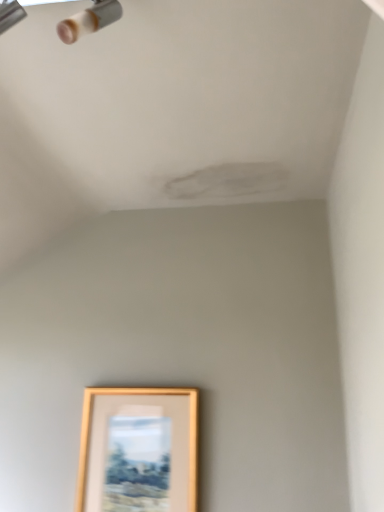
What do you see at coordinates (138, 450) in the screenshot? The image size is (384, 512). I see `gold wooden picture frame at lower center` at bounding box center [138, 450].

Where is `gold wooden picture frame at lower center`? The height and width of the screenshot is (512, 384). gold wooden picture frame at lower center is located at coordinates (138, 450).

You are a GUI agent. You are given a task and a screenshot of the screen. Output one action in this format:
    pyautogui.click(x=<x>, y=<y>)
    Task: Click on the gold wooden picture frame at lower center
    Image resolution: width=384 pixels, height=512 pixels.
    Given the screenshot: What is the action you would take?
    pyautogui.click(x=138, y=450)